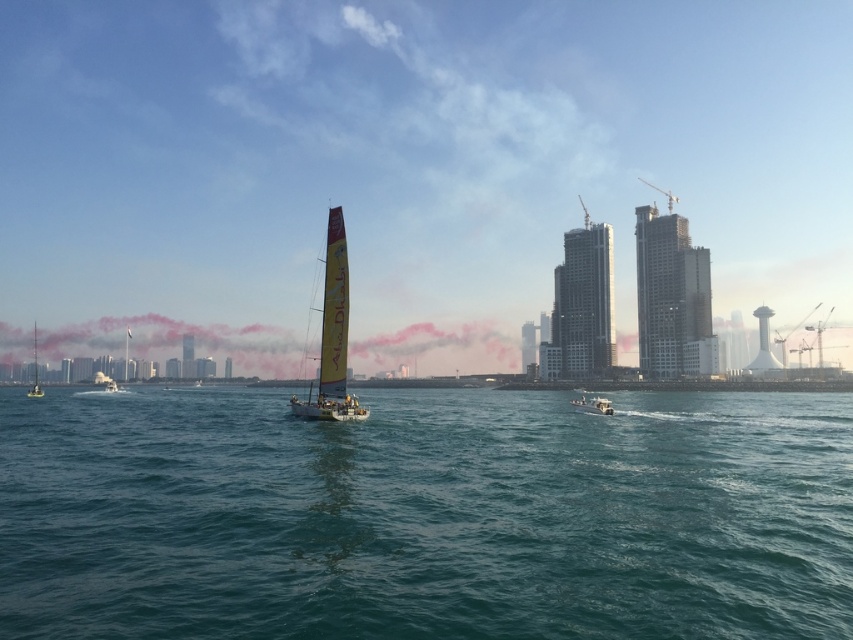
What is the 2D coordinate of the pink smoke at center?

The pink smoke at center is located at the 2D coordinate point of (178, 340).

You are standing on the dock and see the teal water at center and pink smoke at center. Which one is nearer to you?

The teal water at center is closer to the viewer than the pink smoke at center.

You are a photographer trying to capture both the yellow fabric sailboat at center and the metallic silver boat at center in a single shot. Given their sizes in the image, which boat will appear smaller in your photo?

The yellow fabric sailboat at center will appear smaller in the photo because it occupies less space than the metallic silver boat at center according to the description.